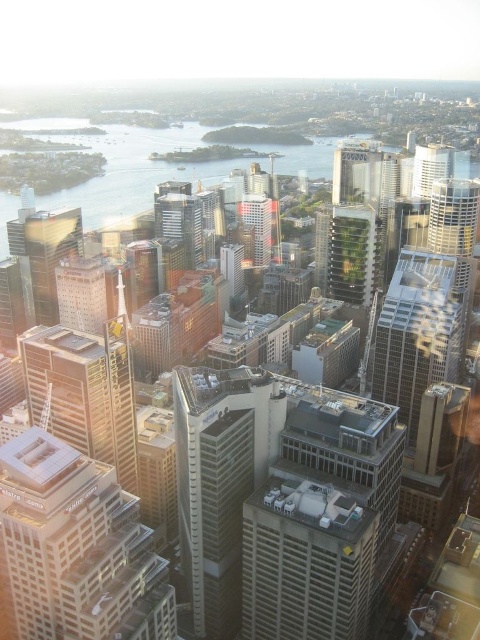
Question: Can you confirm if matte glass skyscraper at left is thinner than metallic glass skyscraper at center-right?

Choices:
 (A) no
 (B) yes

Answer: (B)

Question: Estimate the real-world distances between objects in this image. Which object is farther from the matte glass skyscraper at center?

Choices:
 (A) transparent glass water at center
 (B) white glass building at center
 (C) metallic glass skyscraper at center-right

Answer: (B)

Question: Is white glass building at center positioned in front of matte glass skyscraper at center?

Choices:
 (A) yes
 (B) no

Answer: (A)

Question: Among these points, which one is nearest to the camera?

Choices:
 (A) (28, 560)
 (B) (188, 468)

Answer: (A)

Question: In this image, where is silver metallic skyscraper at center located relative to transparent glass water at center?

Choices:
 (A) right
 (B) left

Answer: (A)

Question: Among these objects, which one is nearest to the camera?

Choices:
 (A) white glass building at center
 (B) shiny glass skyscraper at center
 (C) silver glass tower at upper right
 (D) transparent glass water at center

Answer: (A)